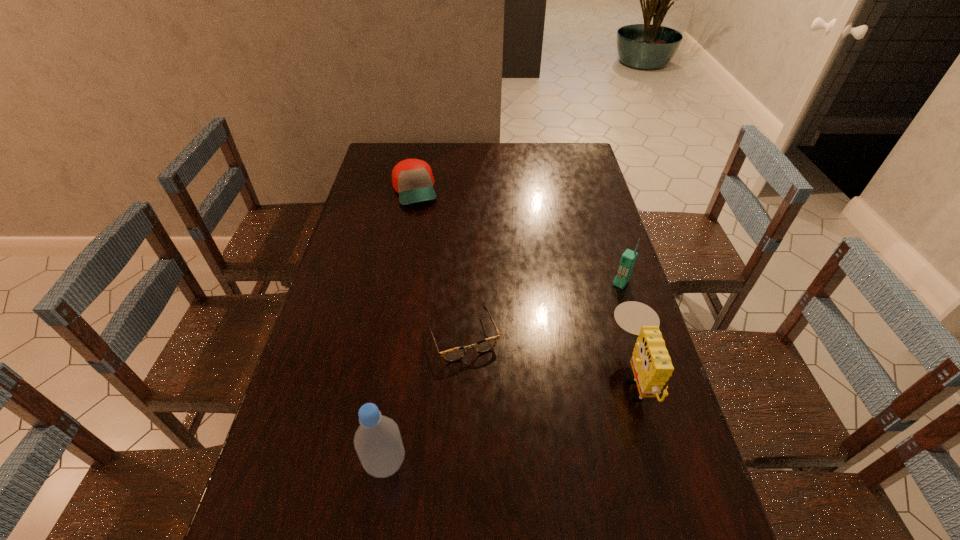
Where is `bottle`? The width and height of the screenshot is (960, 540). bottle is located at coordinates (377, 441).

Image resolution: width=960 pixels, height=540 pixels. Identify the location of the tallest object. pos(377,441).

Identify the location of sponge. (652, 367).

Identify the location of the fourth tallest object. (412, 179).

Image resolution: width=960 pixels, height=540 pixels. I want to click on the farthest object, so click(412, 179).

Identify the location of the third object from right to left. Image resolution: width=960 pixels, height=540 pixels. (452, 355).

Where is `spectacles`? This screenshot has height=540, width=960. spectacles is located at coordinates (452, 355).

At what (x,y) coordinates should I click in order to perform the action: click on the second farthest object. Please return your answer as a coordinate pair (x, y). The height and width of the screenshot is (540, 960). Looking at the image, I should click on tap(628, 258).

Find the location of a particular element. The width and height of the screenshot is (960, 540). free spot located 0.080m on the front of the nearest object is located at coordinates (376, 526).

Locate an element on the screen. vacant region located 0.060m on the front-facing side of the sponge is located at coordinates pos(588,376).